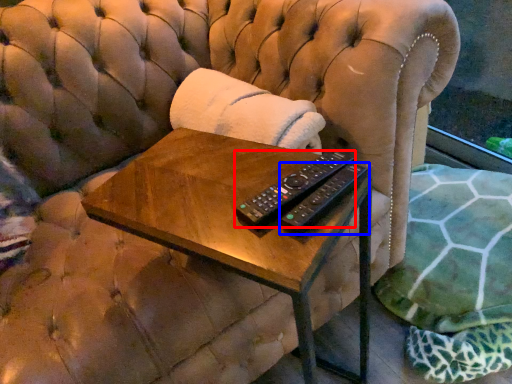
Question: Which object is closer to the camera taking this photo, remote control (highlighted by a red box) or remote control (highlighted by a blue box)?

Choices:
 (A) remote control
 (B) remote control

Answer: (B)